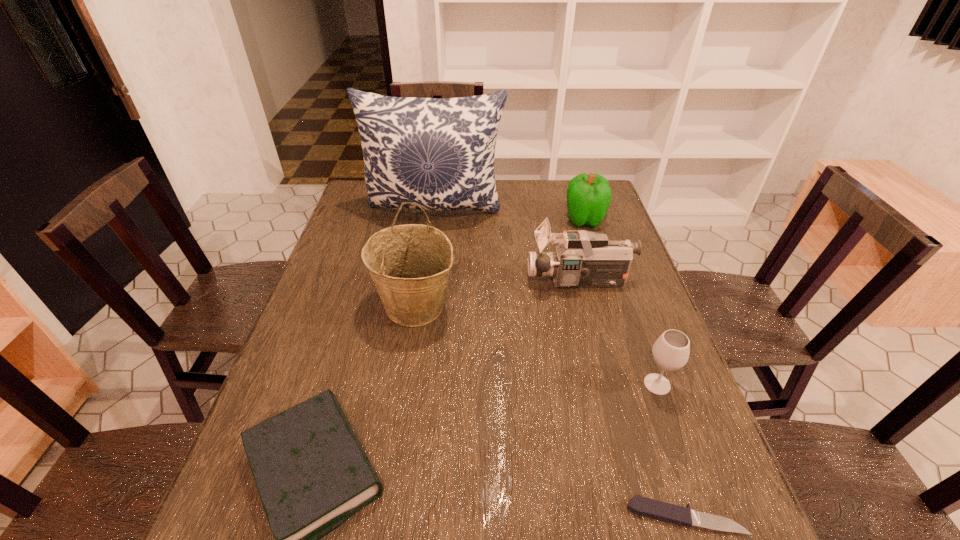
Image resolution: width=960 pixels, height=540 pixels. In order to click on wineglass positioned at the right edge in this screenshot , I will do `click(670, 352)`.

This screenshot has height=540, width=960. Identify the location of steak knife that is positioned at the right edge. (658, 510).

The height and width of the screenshot is (540, 960). I want to click on object located at the far left corner, so click(x=438, y=153).

Where is `object present at the far right corner`? Image resolution: width=960 pixels, height=540 pixels. object present at the far right corner is located at coordinates (588, 196).

This screenshot has height=540, width=960. Identify the location of object that is at the near right corner. (658, 510).

Image resolution: width=960 pixels, height=540 pixels. In order to click on vacant area at the far edge of the desktop in this screenshot , I will do `click(551, 212)`.

Identify the location of blank area at the left edge. This screenshot has width=960, height=540. (281, 379).

You are a GUI agent. You are given a task and a screenshot of the screen. Output one action in this format:
    pyautogui.click(x=<x>, y=<y>)
    Task: Click on the free space at the right edge of the desktop
    
    Given the screenshot: What is the action you would take?
    pyautogui.click(x=624, y=326)

Where is `vacant point at the far left corner`? This screenshot has width=960, height=540. vacant point at the far left corner is located at coordinates (361, 187).

Image resolution: width=960 pixels, height=540 pixels. I want to click on free space that is in between the third nearest object and the camcorder, so click(x=618, y=333).